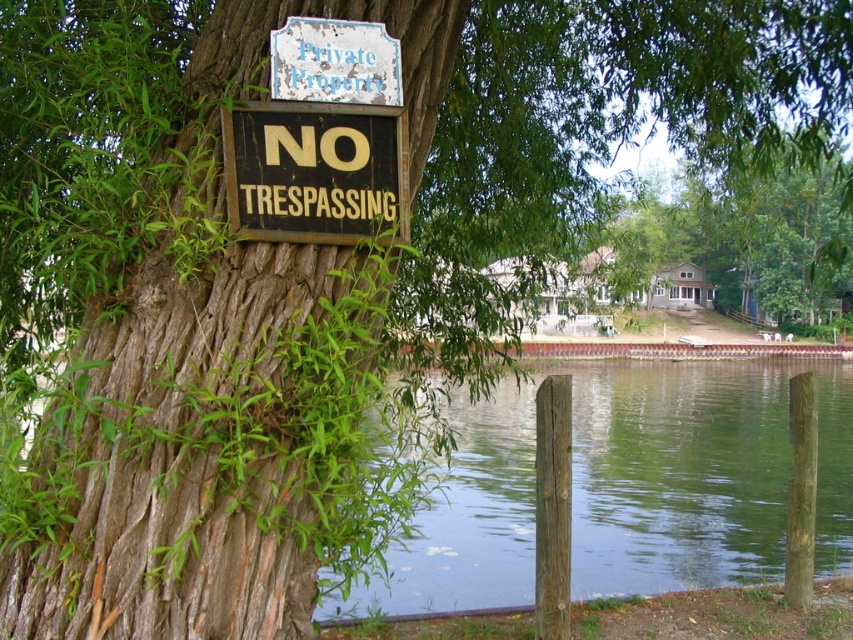
Question: Based on their relative distances, which object is farther from the green water at lower center?

Choices:
 (A) white faded wood sign at upper center
 (B) black wood sign at upper center

Answer: (A)

Question: Is black wood sign at upper center wider than white faded wood sign at upper center?

Choices:
 (A) no
 (B) yes

Answer: (B)

Question: Which object appears farthest from the camera in this image?

Choices:
 (A) green water at lower center
 (B) black wood sign at upper center
 (C) white faded wood sign at upper center

Answer: (A)

Question: From the image, what is the correct spatial relationship of green water at lower center in relation to white faded wood sign at upper center?

Choices:
 (A) right
 (B) left

Answer: (A)

Question: Can you confirm if green water at lower center is positioned below black wood sign at upper center?

Choices:
 (A) yes
 (B) no

Answer: (A)

Question: Which object is the closest to the white faded wood sign at upper center?

Choices:
 (A) green water at lower center
 (B) black wood sign at upper center

Answer: (B)